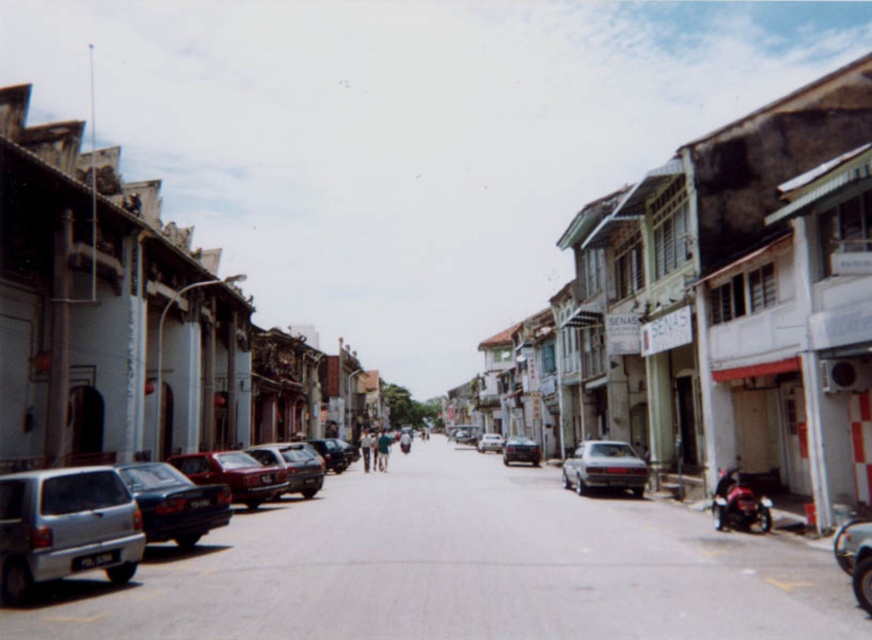
Question: Estimate the real-world distances between objects in this image. Which object is closer to the satin silver car at center?

Choices:
 (A) matte silver sedan at center
 (B) shiny dark blue sedan at center-left
 (C) matte silver car at center

Answer: (C)

Question: From the image, what is the correct spatial relationship of shiny red motorbike at right in relation to matte silver sedan at center?

Choices:
 (A) above
 (B) below

Answer: (A)

Question: Does silver metallic car at left have a greater width compared to shiny red motorbike at right?

Choices:
 (A) no
 (B) yes

Answer: (A)

Question: From the image, what is the correct spatial relationship of shiny dark blue sedan at center-left in relation to satin silver car at center?

Choices:
 (A) left
 (B) right

Answer: (A)

Question: Which point is closer to the camera?

Choices:
 (A) silver metallic car at left
 (B) shiny dark blue sedan at center-left

Answer: (A)

Question: Which point appears closest to the camera in this image?

Choices:
 (A) (x=569, y=472)
 (B) (x=303, y=465)
 (C) (x=138, y=529)

Answer: (C)